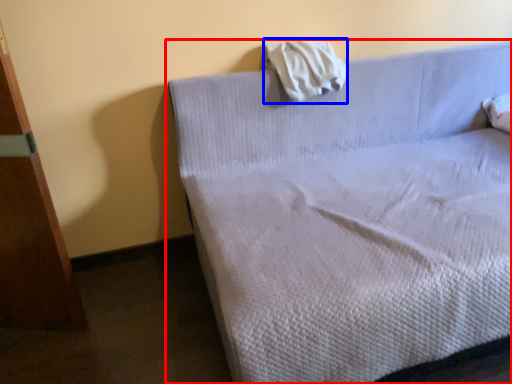
Question: Which object is closer to the camera taking this photo, bed (highlighted by a red box) or cloth (highlighted by a blue box)?

Choices:
 (A) bed
 (B) cloth

Answer: (A)